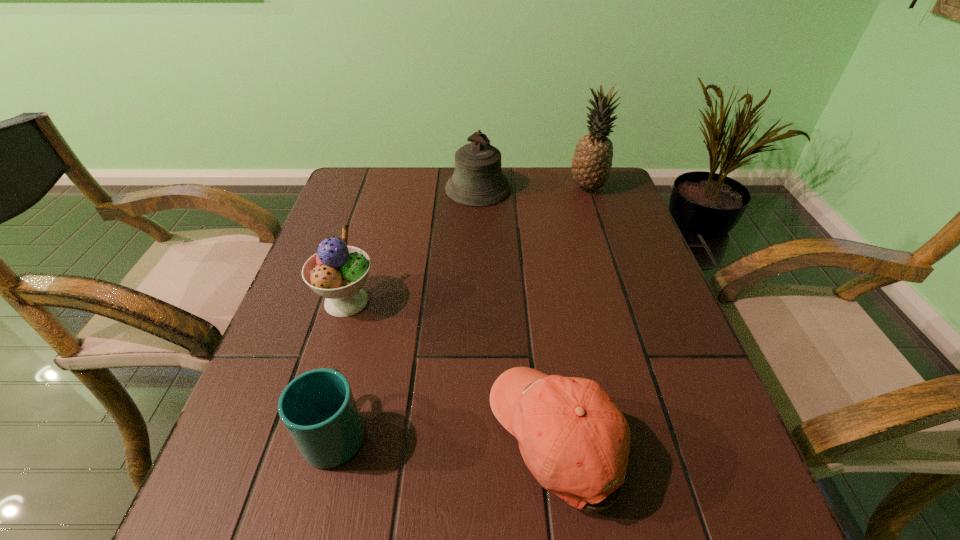
This screenshot has height=540, width=960. Find the location of `vacant region at the far edge`. vacant region at the far edge is located at coordinates (405, 181).

You are a GUI agent. You are given a task and a screenshot of the screen. Output one action in this format:
    pyautogui.click(x=<x>, y=<y>)
    Task: Click on the free location at the near edge of the desktop
    The height and width of the screenshot is (540, 960).
    Given the screenshot: What is the action you would take?
    pyautogui.click(x=354, y=538)

This screenshot has width=960, height=540. In the image, there is a desktop. Identify the location of vacant space at the left edge. (281, 390).

Where is `free space at the right edge of the desktop`? Image resolution: width=960 pixels, height=540 pixels. free space at the right edge of the desktop is located at coordinates (673, 358).

This screenshot has width=960, height=540. Identify the location of vacant space at the far left corner of the desktop. (377, 173).

In the image, there is a desktop. Where is `vacant area at the near left corner`? vacant area at the near left corner is located at coordinates (292, 539).

Where is `vacant space at the far right corner of the desktop`? Image resolution: width=960 pixels, height=540 pixels. vacant space at the far right corner of the desktop is located at coordinates (598, 211).

The height and width of the screenshot is (540, 960). Find the location of `free space between the icecream and the baseball cap`. free space between the icecream and the baseball cap is located at coordinates (453, 369).

The width and height of the screenshot is (960, 540). In order to click on free area in between the baseball cap and the cup in this screenshot , I will do `click(447, 434)`.

Image resolution: width=960 pixels, height=540 pixels. I want to click on free area in between the bell and the cup, so click(407, 309).